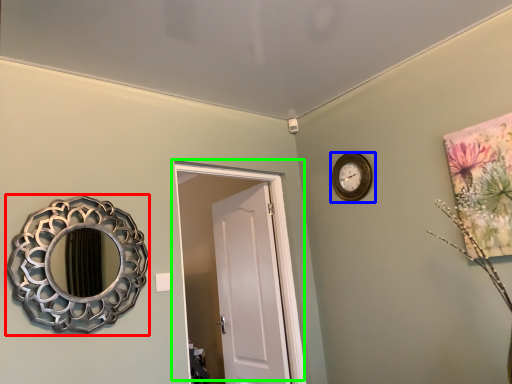
Question: Which object is positioned closest to mirror (highlighted by a red box)? Select from wall clock (highlighted by a blue box) and door (highlighted by a green box).

Choices:
 (A) wall clock
 (B) door

Answer: (B)